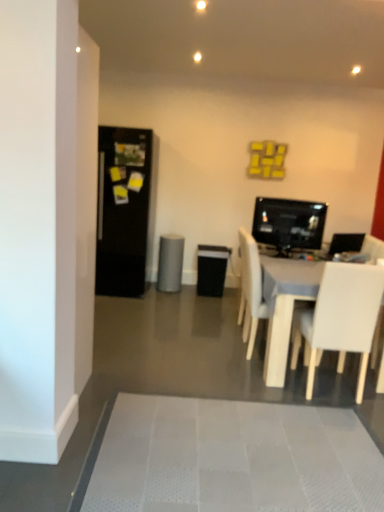
You are a GUI agent. You are given a task and a screenshot of the screen. Output one action in this format:
    pyautogui.click(x=<x>, y=<y>)
    Task: Click on the vacant area in front of black matte refrigerator at left
    
    Given the screenshot: What is the action you would take?
    pyautogui.click(x=125, y=306)